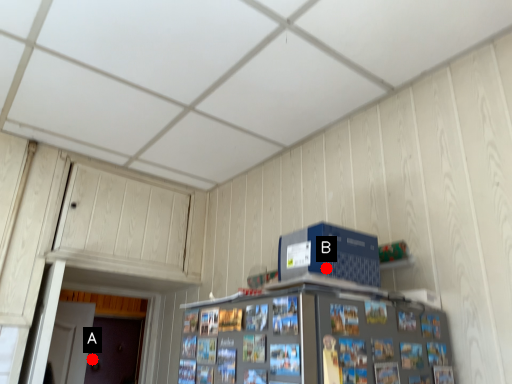
Question: Two points are circled on the image, labeled by A and B beside each circle. Among these points, which one is farthest from the camera?

Choices:
 (A) A is further
 (B) B is further

Answer: (A)